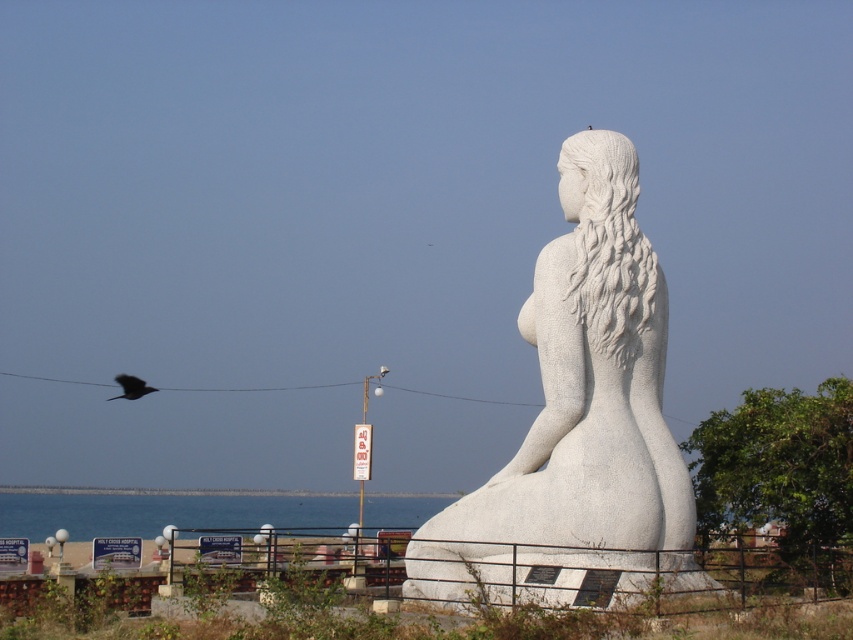
Question: Which point is closer to the camera taking this photo?

Choices:
 (A) (575, 333)
 (B) (148, 388)

Answer: (A)

Question: Is white stone statue at center below dark feathered bird at upper left?

Choices:
 (A) yes
 (B) no

Answer: (B)

Question: Does white stone statue at center appear on the left side of dark feathered bird at upper left?

Choices:
 (A) yes
 (B) no

Answer: (B)

Question: Does white stone statue at center have a smaller size compared to dark feathered bird at upper left?

Choices:
 (A) yes
 (B) no

Answer: (B)

Question: Among these points, which one is nearest to the camera?

Choices:
 (A) (575, 545)
 (B) (122, 381)

Answer: (A)